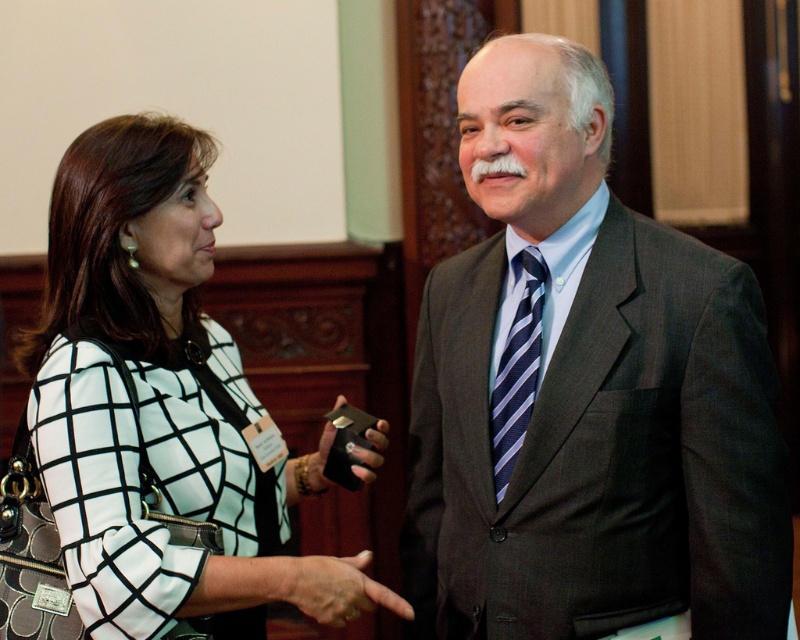
Between white checkered blazer at center and black leather wallet at center, which one is positioned lower?

black leather wallet at center is lower down.

Who is shorter, white checkered blazer at center or black leather wallet at center?

With less height is black leather wallet at center.

Does point (164, 304) lie behind point (368, 442)?

No.

Find the location of a particular element. This screenshot has width=800, height=640. white checkered blazer at center is located at coordinates (150, 392).

From the picture: Which is more to the right, dark gray suit at center or black leather wallet at center?

From the viewer's perspective, dark gray suit at center appears more on the right side.

Does dark gray suit at center appear on the right side of black leather wallet at center?

Yes, dark gray suit at center is to the right of black leather wallet at center.

Measure the distance between dark gray suit at center and camera.

dark gray suit at center is 5.57 feet away from camera.

Find the location of a particular element. The width and height of the screenshot is (800, 640). dark gray suit at center is located at coordinates (586, 392).

How much distance is there between dark gray suit at center and leather textured hand at center?

dark gray suit at center is 19.75 inches from leather textured hand at center.

Which of these two, dark gray suit at center or leather textured hand at center, stands shorter?

leather textured hand at center is shorter.

Who is more forward, (649, 380) or (316, 577)?

Point (649, 380)

Identify the location of dark gray suit at center. This screenshot has height=640, width=800. (586, 392).